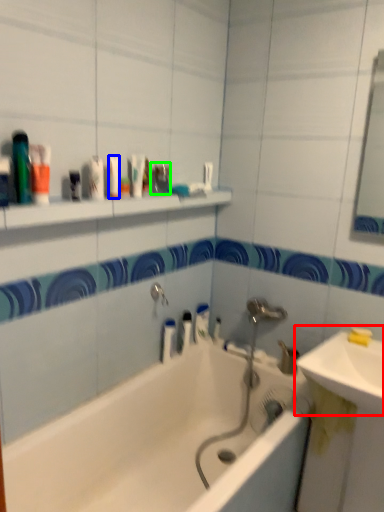
Question: Considering the real-world distances, which object is closest to sink (highlighted by a red box)? mouthwash (highlighted by a blue box) or toiletry (highlighted by a green box).

Choices:
 (A) mouthwash
 (B) toiletry

Answer: (B)